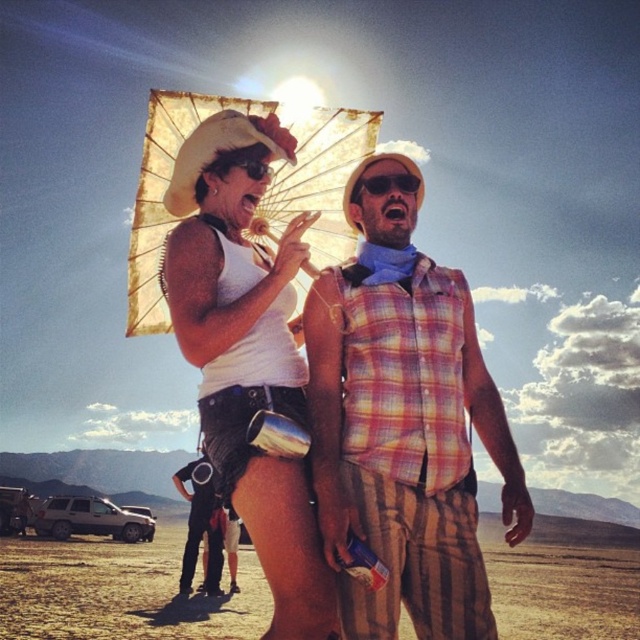
Does matte white umbrella at upper center appear over dirt field at lower center?

Indeed, matte white umbrella at upper center is positioned over dirt field at lower center.

Who is positioned more to the left, matte white umbrella at upper center or dirt field at lower center?

matte white umbrella at upper center is more to the left.

The height and width of the screenshot is (640, 640). What do you see at coordinates (248, 352) in the screenshot?
I see `matte white umbrella at upper center` at bounding box center [248, 352].

Where is `matte white umbrella at upper center`? This screenshot has width=640, height=640. matte white umbrella at upper center is located at coordinates (248, 352).

Does plaid fabric shirt at center have a smaller size compared to gold paper parasol at upper center?

Correct, plaid fabric shirt at center occupies less space than gold paper parasol at upper center.

Describe the element at coordinates (403, 420) in the screenshot. The image size is (640, 640). I see `plaid fabric shirt at center` at that location.

Between point (451, 484) and point (150, 106), which one is positioned behind?

Positioned behind is point (150, 106).

Find the location of `plaid fabric shirt at center`. plaid fabric shirt at center is located at coordinates (403, 420).

Can you confirm if plaid fabric shirt at center is taller than matte white umbrella at upper center?

No, plaid fabric shirt at center is not taller than matte white umbrella at upper center.

Who is positioned more to the left, plaid fabric shirt at center or matte white umbrella at upper center?

Positioned to the left is matte white umbrella at upper center.

Locate an element on the screen. The image size is (640, 640). plaid fabric shirt at center is located at coordinates point(403,420).